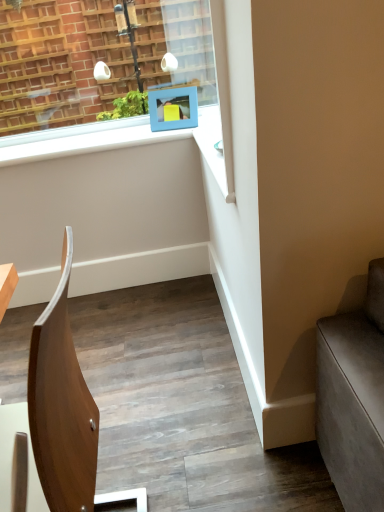
The height and width of the screenshot is (512, 384). Describe the element at coordinates (173, 108) in the screenshot. I see `blue matte picture frame at upper center` at that location.

You are a GUI agent. You are given a task and a screenshot of the screen. Output one action in this format:
    pyautogui.click(x=<x>, y=<y>)
    Task: Click on the blue matte picture frame at upper center
    
    Given the screenshot: What is the action you would take?
    pyautogui.click(x=173, y=108)

The height and width of the screenshot is (512, 384). Describe the element at coordinates (65, 411) in the screenshot. I see `wooden chair at center` at that location.

This screenshot has height=512, width=384. What are the coordinates of `wooden chair at center` in the screenshot? It's located at (65, 411).

Locate an element on the screen. The height and width of the screenshot is (512, 384). blue matte picture frame at upper center is located at coordinates (173, 108).

Considering the positions of objects wooden chair at center and blue matte picture frame at upper center in the image provided, who is more to the right, wooden chair at center or blue matte picture frame at upper center?

blue matte picture frame at upper center.

Which object is closer to the camera taking this photo, wooden chair at center or blue matte picture frame at upper center?

Positioned in front is wooden chair at center.

Is point (34, 399) farther from camera compared to point (194, 114)?

No, (34, 399) is closer to viewer.

From the image's perspective, which object appears higher, wooden chair at center or blue matte picture frame at upper center?

From the image's view, blue matte picture frame at upper center is above.

From a real-world perspective, is wooden chair at center positioned above or below blue matte picture frame at upper center?

wooden chair at center is situated lower than blue matte picture frame at upper center in the real world.

Which of these two, wooden chair at center or blue matte picture frame at upper center, is wider?

Wider between the two is wooden chair at center.

Which of these two, wooden chair at center or blue matte picture frame at upper center, stands taller?

With more height is wooden chair at center.

Considering the relative sizes of wooden chair at center and blue matte picture frame at upper center in the image provided, is wooden chair at center smaller than blue matte picture frame at upper center?

Incorrect, wooden chair at center is not smaller in size than blue matte picture frame at upper center.

Is wooden chair at center not inside blue matte picture frame at upper center?

Absolutely, wooden chair at center is external to blue matte picture frame at upper center.

Would you consider wooden chair at center to be distant from blue matte picture frame at upper center?

Yes, wooden chair at center and blue matte picture frame at upper center are located far from each other.

Is wooden chair at center oriented towards blue matte picture frame at upper center?

No, wooden chair at center does not turn towards blue matte picture frame at upper center.

What's the angular difference between wooden chair at center and blue matte picture frame at upper center's facing directions?

The facing directions of wooden chair at center and blue matte picture frame at upper center are 76.9 degrees apart.

Identify the location of chair in front of the blue matte picture frame at upper center. (65, 411).

Consider the image. Considering the relative positions of blue matte picture frame at upper center and wooden chair at center in the image provided, is blue matte picture frame at upper center to the left of wooden chair at center from the viewer's perspective?

In fact, blue matte picture frame at upper center is to the right of wooden chair at center.

Considering their positions, is blue matte picture frame at upper center located in front of or behind wooden chair at center?

In the image, blue matte picture frame at upper center appears behind wooden chair at center.

Which point is more distant from viewer, (161, 93) or (65, 394)?

The point (161, 93) is farther from the camera.

From the image's perspective, is blue matte picture frame at upper center positioned above or below wooden chair at center?

blue matte picture frame at upper center is situated higher than wooden chair at center in the image.

From a real-world perspective, does blue matte picture frame at upper center sit lower than wooden chair at center?

No, from a real-world perspective, blue matte picture frame at upper center is not beneath wooden chair at center.

Which object is thinner, blue matte picture frame at upper center or wooden chair at center?

blue matte picture frame at upper center.

Does blue matte picture frame at upper center have a greater height compared to wooden chair at center?

No, blue matte picture frame at upper center is not taller than wooden chair at center.

Is blue matte picture frame at upper center bigger than wooden chair at center?

No, blue matte picture frame at upper center is not bigger than wooden chair at center.

Is blue matte picture frame at upper center situated inside wooden chair at center or outside?

blue matte picture frame at upper center is not inside wooden chair at center, it's outside.

Can you see blue matte picture frame at upper center touching wooden chair at center?

They are not placed beside each other.

Is blue matte picture frame at upper center oriented towards wooden chair at center?

Yes, blue matte picture frame at upper center is facing wooden chair at center.

How many degrees apart are the facing directions of blue matte picture frame at upper center and wooden chair at center?

The angular difference between blue matte picture frame at upper center and wooden chair at center is 76.9 degrees.

This screenshot has width=384, height=512. What are the coordinates of `picture frame behind the wooden chair at center` in the screenshot? It's located at (173, 108).

At what (x,y) coordinates should I click in order to perform the action: click on chair that appears below the blue matte picture frame at upper center (from the image's perspective). Please return your answer as a coordinate pair (x, y). The image size is (384, 512). Looking at the image, I should click on (65, 411).

Locate an element on the screen. The image size is (384, 512). picture frame above the wooden chair at center (from a real-world perspective) is located at coordinates (173, 108).